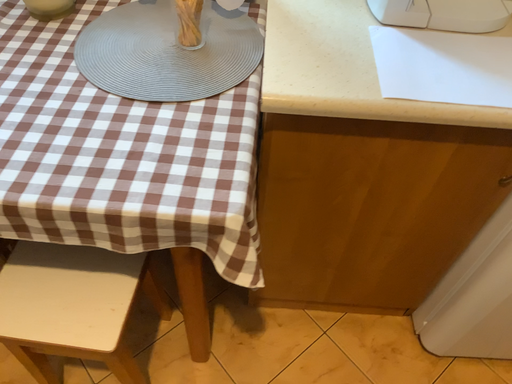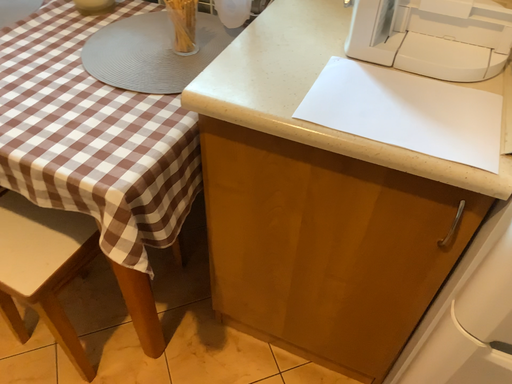
Question: Which way did the camera rotate in the video?

Choices:
 (A) rotated upward
 (B) rotated downward

Answer: (A)